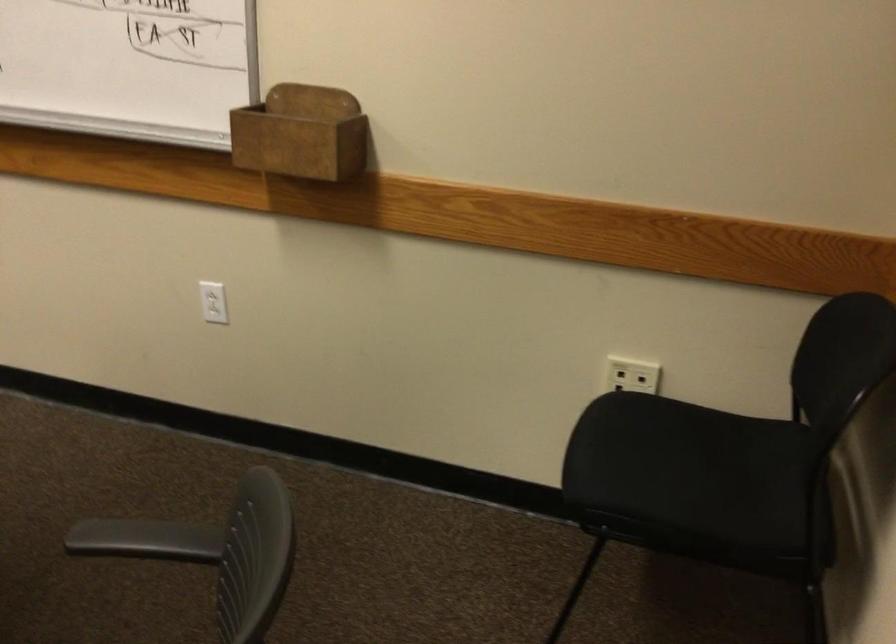
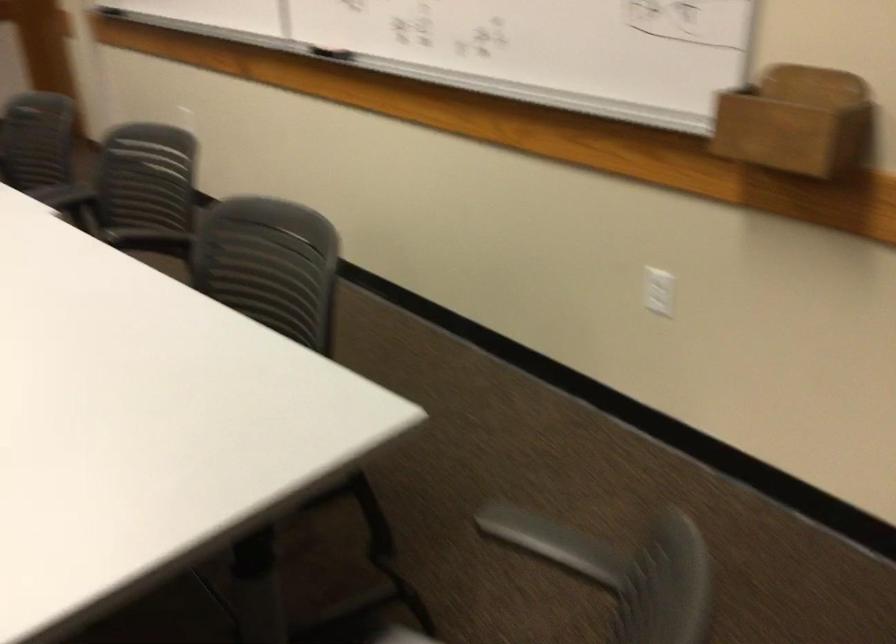
Find the pixel in the second image that matches (306,131) in the first image.

(797, 122)